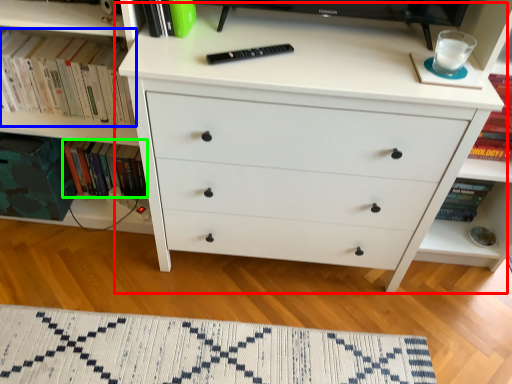
Question: Considering the real-world distances, which object is closest to chest of drawers (highlighted by a red box)? book (highlighted by a blue box) or book (highlighted by a green box).

Choices:
 (A) book
 (B) book

Answer: (A)